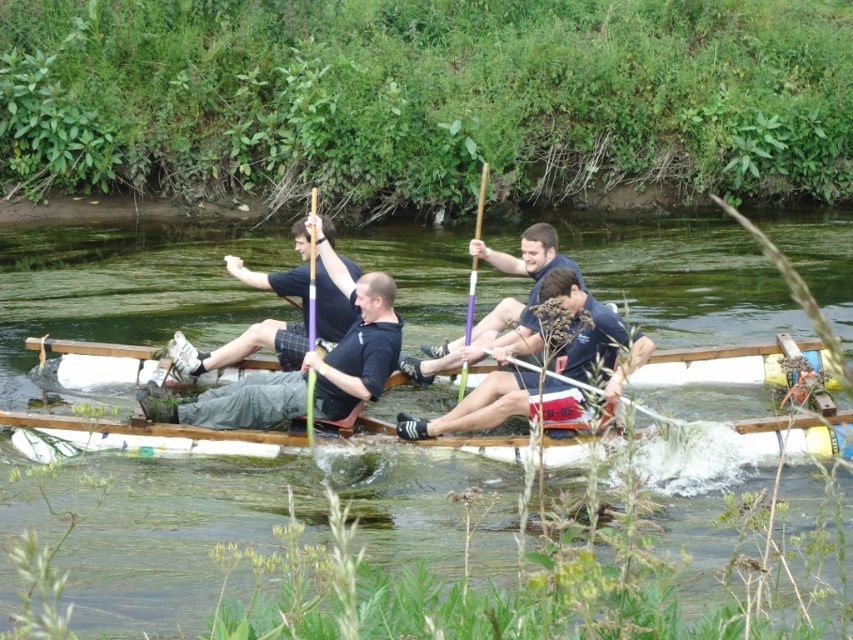
You are a photographer standing on the dock next to the boat. You want to take a photo of the black matte shirt at center and the purple wood paddle at center. Which object should you focus on first if you want to capture both in the same frame without moving the camera?

The black matte shirt at center is to the left of purple wood paddle at center, so you should focus on the black matte shirt at center first to ensure both are in the frame.